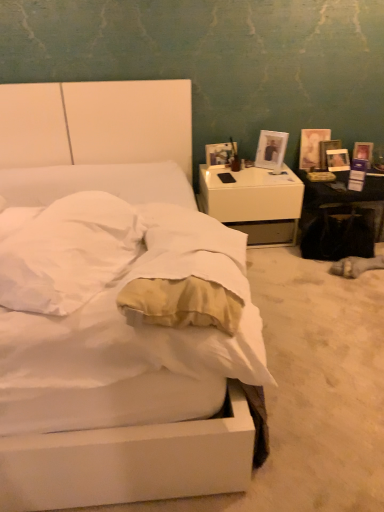
This screenshot has width=384, height=512. I want to click on empty space that is ontop of white glossy nightstand at upper right (from a real-world perspective), so click(246, 172).